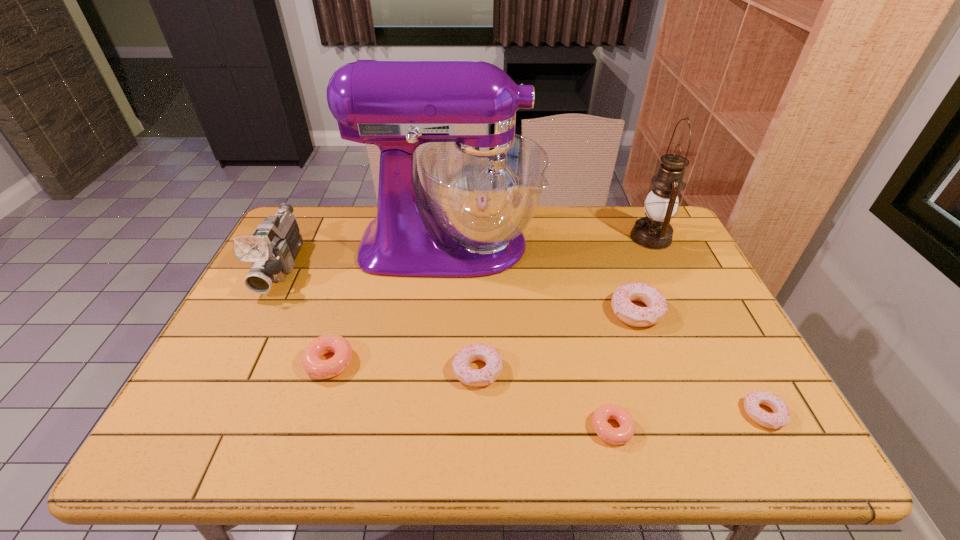
Locate an element on the screen. The height and width of the screenshot is (540, 960). free location located on the right of the farther pink doughnut is located at coordinates (497, 362).

The height and width of the screenshot is (540, 960). I want to click on free point located 0.210m on the left of the second farthest white doughnut, so click(366, 370).

You are a GUI agent. You are given a task and a screenshot of the screen. Output one action in this format:
    pyautogui.click(x=<x>, y=<y>)
    Task: Click on the blank space located 0.130m on the right of the third doughnut from right to left
    The image size is (960, 540).
    Given the screenshot: What is the action you would take?
    pyautogui.click(x=693, y=428)

Where is `vacant space located on the back of the rightmost white doughnut`? vacant space located on the back of the rightmost white doughnut is located at coordinates (717, 327).

This screenshot has width=960, height=540. What are the coordinates of `mixer present at the far edge` in the screenshot? It's located at (483, 183).

The width and height of the screenshot is (960, 540). Find the location of `oil lamp that is at the far edge`. oil lamp that is at the far edge is located at coordinates (654, 231).

Find the location of a particular element. Image resolution: width=960 pixels, height=540 pixels. camcorder located at the far edge is located at coordinates (271, 250).

Find the location of a particular element. Image resolution: width=960 pixels, height=540 pixels. object that is at the left edge is located at coordinates (271, 250).

I want to click on oil lamp present at the right edge, so click(x=654, y=231).

Identify the location of doughnut located in the right edge section of the desktop. This screenshot has width=960, height=540. (781, 416).